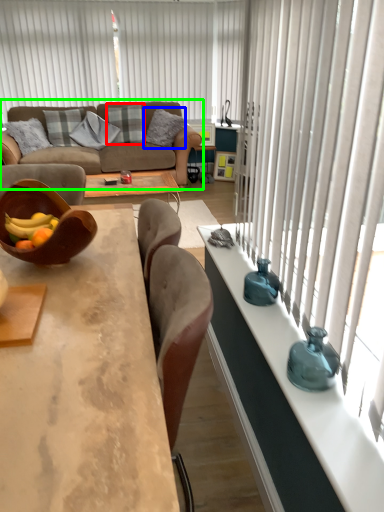
Question: Based on their relative distances, which object is nearer to pillow (highlighted by a red box)? Choose from pillow (highlighted by a blue box) and studio couch (highlighted by a green box).

Choices:
 (A) pillow
 (B) studio couch

Answer: (A)